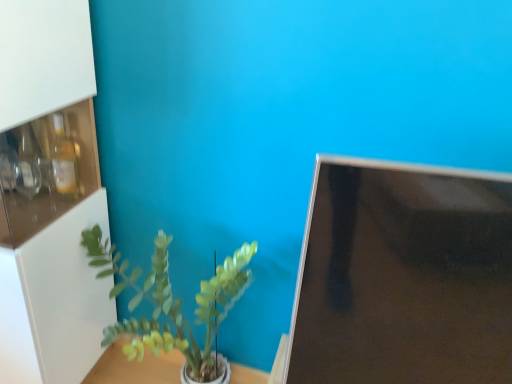
Question: Is black glossy monitor at right completely or partially outside of white glossy cabinet at left?

Choices:
 (A) no
 (B) yes

Answer: (B)

Question: Is black glossy monitor at right bigger than white glossy cabinet at left?

Choices:
 (A) yes
 (B) no

Answer: (B)

Question: Is black glossy monitor at right to the right of white glossy cabinet at left from the viewer's perspective?

Choices:
 (A) no
 (B) yes

Answer: (B)

Question: Does black glossy monitor at right lie in front of white glossy cabinet at left?

Choices:
 (A) yes
 (B) no

Answer: (A)

Question: Can you confirm if black glossy monitor at right is positioned to the left of white glossy cabinet at left?

Choices:
 (A) no
 (B) yes

Answer: (A)

Question: Is black glossy monitor at right aimed at white glossy cabinet at left?

Choices:
 (A) no
 (B) yes

Answer: (A)

Question: Would you say white glossy table at center contains white glossy cabinet at left?

Choices:
 (A) no
 (B) yes

Answer: (A)

Question: From the image's perspective, is white glossy table at center located above white glossy cabinet at left?

Choices:
 (A) no
 (B) yes

Answer: (A)

Question: Does white glossy table at center have a greater height compared to white glossy cabinet at left?

Choices:
 (A) no
 (B) yes

Answer: (A)

Question: Can you confirm if white glossy table at center is thinner than white glossy cabinet at left?

Choices:
 (A) no
 (B) yes

Answer: (B)

Question: Is white glossy table at center not near white glossy cabinet at left?

Choices:
 (A) no
 (B) yes

Answer: (A)

Question: Is the depth of white glossy table at center less than that of white glossy cabinet at left?

Choices:
 (A) no
 (B) yes

Answer: (A)

Question: Is white glossy cabinet at left with white glossy table at center?

Choices:
 (A) no
 (B) yes

Answer: (A)